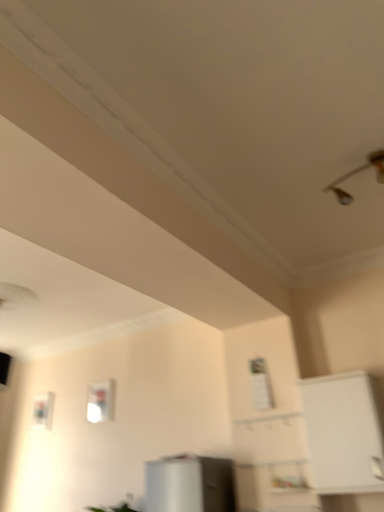
Question: Considering the relative sizes of white matte cabinet at right and transparent glass window at center in the image provided, is white matte cabinet at right bigger than transparent glass window at center?

Choices:
 (A) yes
 (B) no

Answer: (A)

Question: Is transparent glass window at center surrounded by white matte cabinet at right?

Choices:
 (A) yes
 (B) no

Answer: (B)

Question: Is white matte cabinet at right positioned with its back to transparent glass window at center?

Choices:
 (A) no
 (B) yes

Answer: (A)

Question: Is there a large distance between white matte cabinet at right and transparent glass window at center?

Choices:
 (A) no
 (B) yes

Answer: (B)

Question: Would you say white matte cabinet at right is outside transparent glass window at center?

Choices:
 (A) no
 (B) yes

Answer: (B)

Question: Is the depth of white matte cabinet at right greater than that of transparent glass window at center?

Choices:
 (A) yes
 (B) no

Answer: (B)

Question: Does metallic silver light fixture at upper right turn towards transparent glass window at center?

Choices:
 (A) no
 (B) yes

Answer: (A)

Question: Considering the relative sizes of metallic silver light fixture at upper right and transparent glass window at center in the image provided, is metallic silver light fixture at upper right wider than transparent glass window at center?

Choices:
 (A) yes
 (B) no

Answer: (A)

Question: Is metallic silver light fixture at upper right in contact with transparent glass window at center?

Choices:
 (A) yes
 (B) no

Answer: (B)

Question: Is the depth of metallic silver light fixture at upper right greater than that of transparent glass window at center?

Choices:
 (A) yes
 (B) no

Answer: (B)

Question: Is metallic silver light fixture at upper right far away from transparent glass window at center?

Choices:
 (A) yes
 (B) no

Answer: (A)

Question: Considering the relative positions of metallic silver light fixture at upper right and transparent glass window at center in the image provided, is metallic silver light fixture at upper right to the left of transparent glass window at center from the viewer's perspective?

Choices:
 (A) no
 (B) yes

Answer: (A)

Question: Can you confirm if metallic silver light fixture at upper right is smaller than white matte cabinet at right?

Choices:
 (A) no
 (B) yes

Answer: (B)